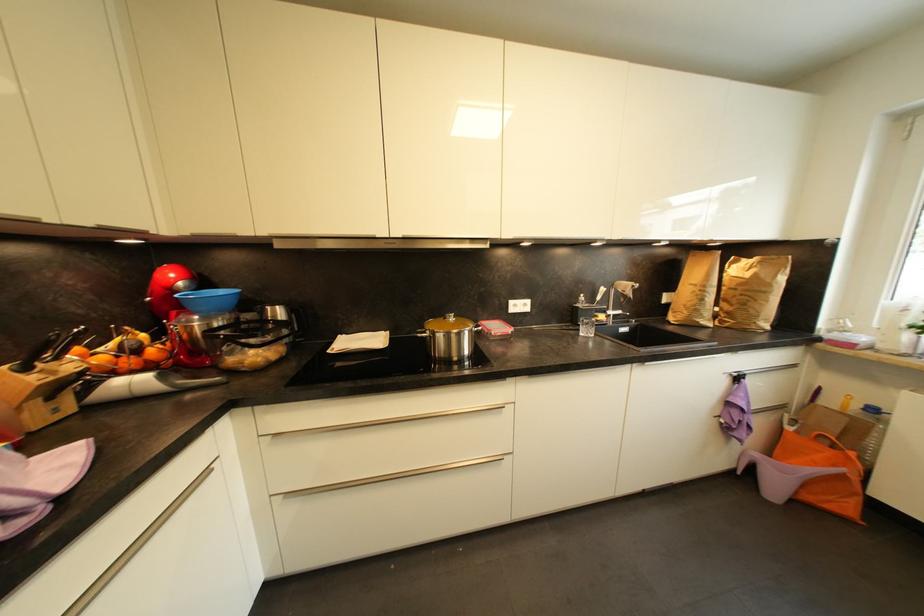
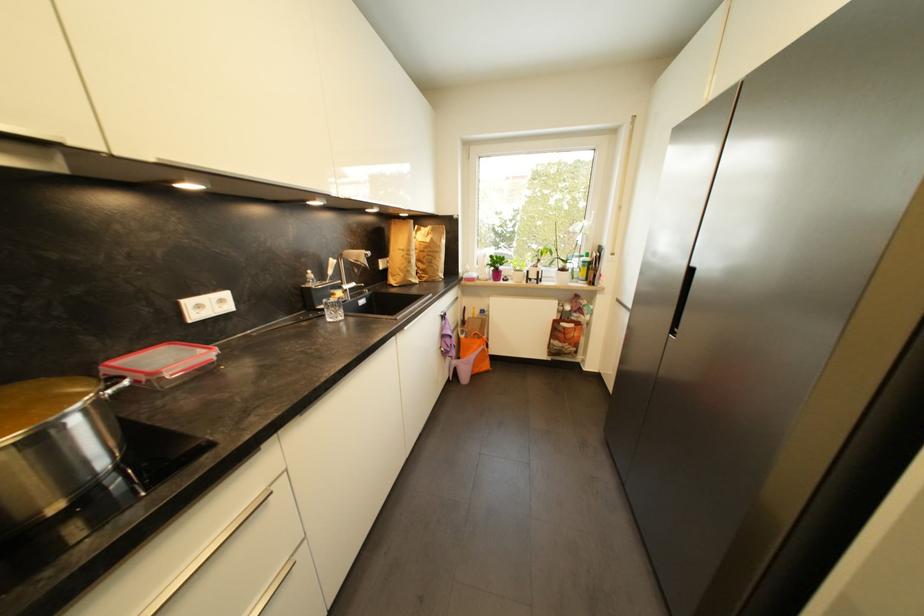
Where in the second image is the point corresponding to point 618,310 from the first image?

(353, 285)